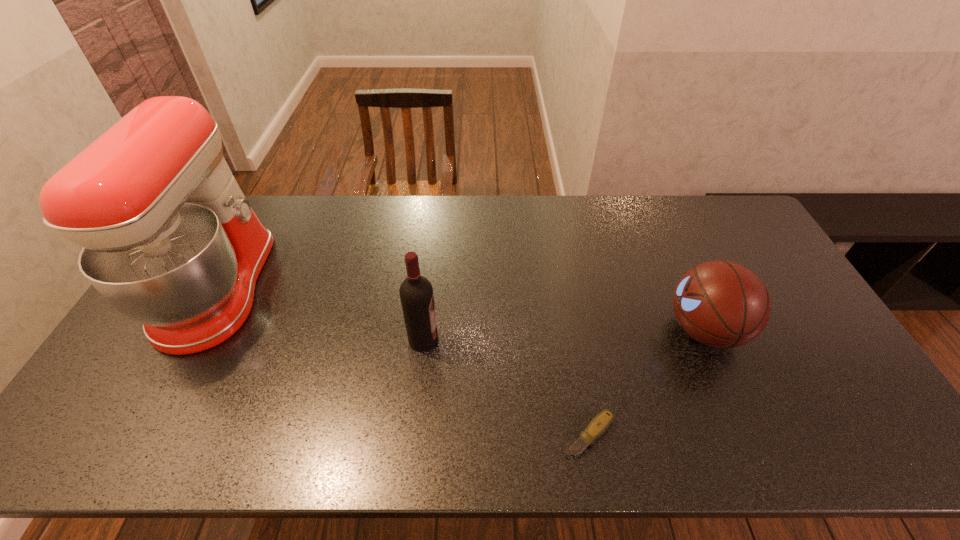
Select which object is the second closest to the wine bottle. Please provide its 2D coordinates. Your answer should be formatted as a tuple, i.e. [(x, y)], where the tuple contains the x and y coordinates of a point satisfying the conditions above.

[(169, 240)]

The image size is (960, 540). What are the coordinates of `free location that satisfies the following two spatial constraints: 1. on the front-facing side of the rightmost object; 2. on the right side of the leftmost object` in the screenshot? It's located at (194, 330).

The height and width of the screenshot is (540, 960). What are the coordinates of `free spot that satisfies the following two spatial constraints: 1. on the front side of the third tallest object; 2. on the label of the second tallest object` in the screenshot? It's located at (708, 340).

Locate an element on the screen. Image resolution: width=960 pixels, height=540 pixels. free spot that satisfies the following two spatial constraints: 1. on the front-facing side of the tallest object; 2. on the left side of the nearest object is located at coordinates (135, 434).

This screenshot has height=540, width=960. I want to click on vacant space that satisfies the following two spatial constraints: 1. on the label of the shortest object; 2. on the right side of the third shortest object, so click(413, 434).

The width and height of the screenshot is (960, 540). Find the location of `blank space that satisfies the following two spatial constraints: 1. on the front side of the rightmost object; 2. on the label of the third object from right to left`. blank space that satisfies the following two spatial constraints: 1. on the front side of the rightmost object; 2. on the label of the third object from right to left is located at coordinates (708, 340).

You are a GUI agent. You are given a task and a screenshot of the screen. Output one action in this format:
    pyautogui.click(x=<x>, y=<y>)
    Task: Click on the vacant point that satisfies the following two spatial constraints: 1. on the front-facing side of the rightmost object; 2. on the right side of the tallest object
    Image resolution: width=960 pixels, height=540 pixels.
    Given the screenshot: What is the action you would take?
    pyautogui.click(x=194, y=330)

Locate an element on the screen. The height and width of the screenshot is (540, 960). vacant space that satisfies the following two spatial constraints: 1. on the front-facing side of the mixer; 2. on the left side of the pocketknife is located at coordinates (135, 434).